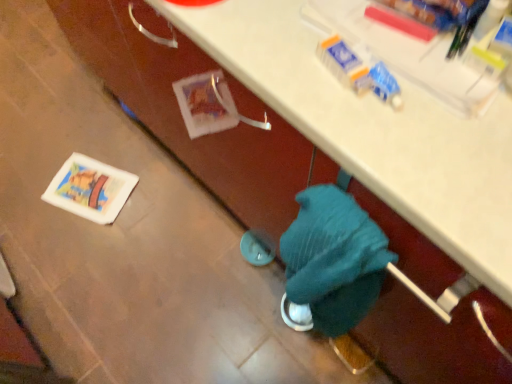
The height and width of the screenshot is (384, 512). Describe the element at coordinates (351, 354) in the screenshot. I see `teal fabric shoe at lower center` at that location.

At what (x,y) coordinates should I click in order to perform the action: click on teal fabric shoe at lower center. Please return your answer as a coordinate pair (x, y). The height and width of the screenshot is (384, 512). Looking at the image, I should click on (351, 354).

I want to click on teal fabric shoe at lower center, so click(351, 354).